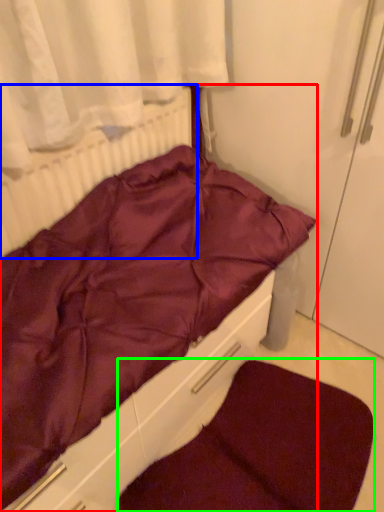
Question: Which is farther away from furniture (highlighted by a red box)? radiator (highlighted by a blue box) or dog bed (highlighted by a green box)?

Choices:
 (A) radiator
 (B) dog bed

Answer: (B)